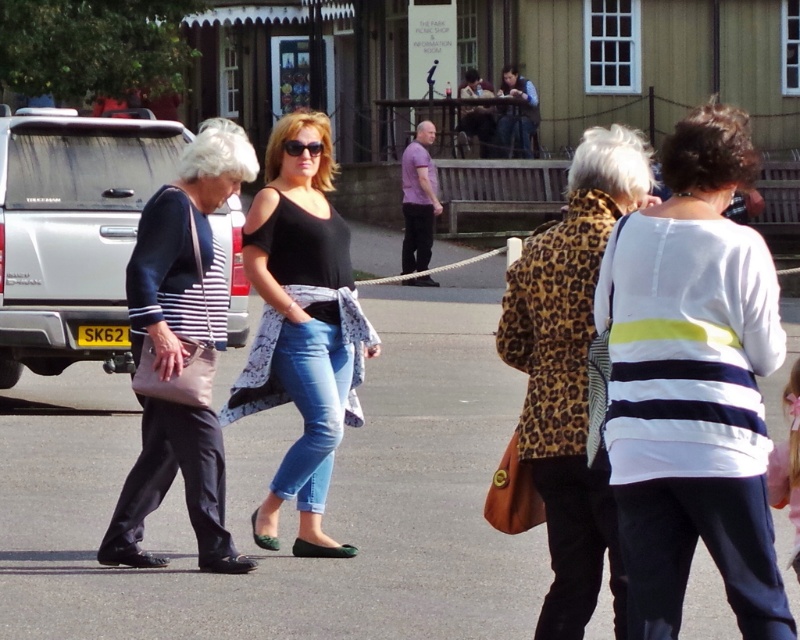
Who is lower down, black matte tank top at center or purple matte shirt at center?

black matte tank top at center is below.

Can you confirm if black matte tank top at center is taller than purple matte shirt at center?

In fact, black matte tank top at center may be shorter than purple matte shirt at center.

Find the location of a particular element. black matte tank top at center is located at coordinates (302, 324).

Where is `black matte tank top at center`? The image size is (800, 640). black matte tank top at center is located at coordinates (302, 324).

Can you confirm if silver metallic pickup truck at left is positioned above matte black jacket at left?

Yes, silver metallic pickup truck at left is above matte black jacket at left.

Does silver metallic pickup truck at left have a larger size compared to matte black jacket at left?

Indeed, silver metallic pickup truck at left has a larger size compared to matte black jacket at left.

The height and width of the screenshot is (640, 800). What do you see at coordinates (72, 234) in the screenshot?
I see `silver metallic pickup truck at left` at bounding box center [72, 234].

The height and width of the screenshot is (640, 800). What are the coordinates of `silver metallic pickup truck at left` in the screenshot? It's located at pos(72,234).

Between silver metallic pickup truck at left and black matte tank top at center, which one has more height?

silver metallic pickup truck at left

In order to click on silver metallic pickup truck at left in this screenshot , I will do `click(72, 234)`.

This screenshot has height=640, width=800. Describe the element at coordinates (72, 234) in the screenshot. I see `silver metallic pickup truck at left` at that location.

Locate an element on the screen. Image resolution: width=800 pixels, height=640 pixels. silver metallic pickup truck at left is located at coordinates (72, 234).